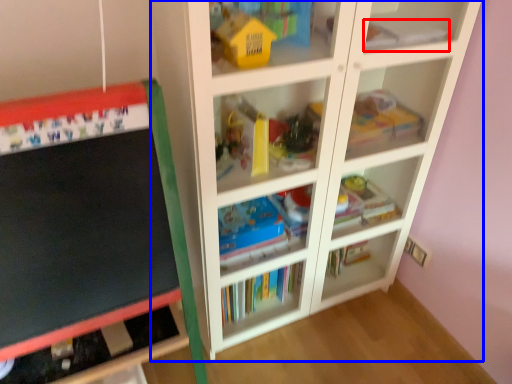
Question: Which of the following is the closest to the observer, book (highlighted by a red box) or shelf (highlighted by a blue box)?

Choices:
 (A) book
 (B) shelf

Answer: (B)